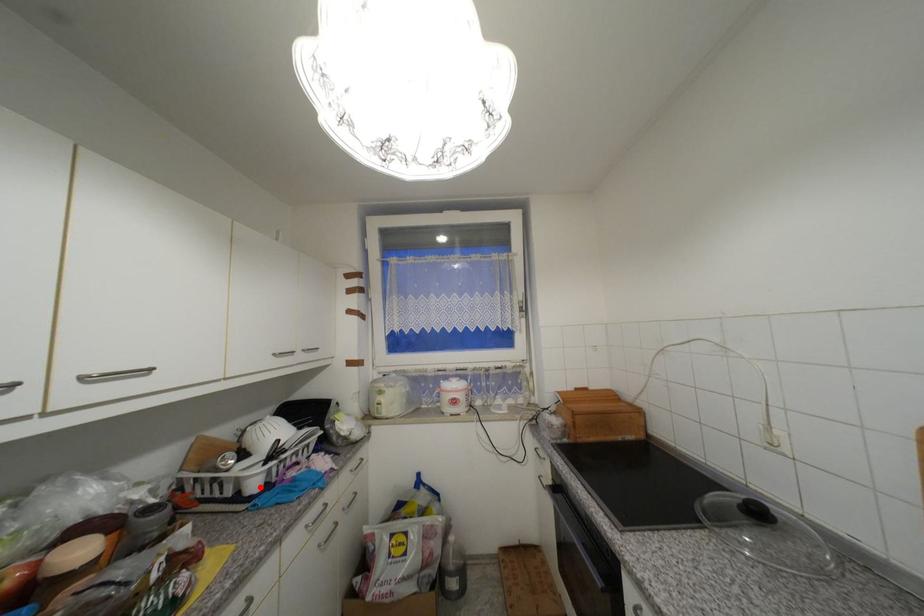
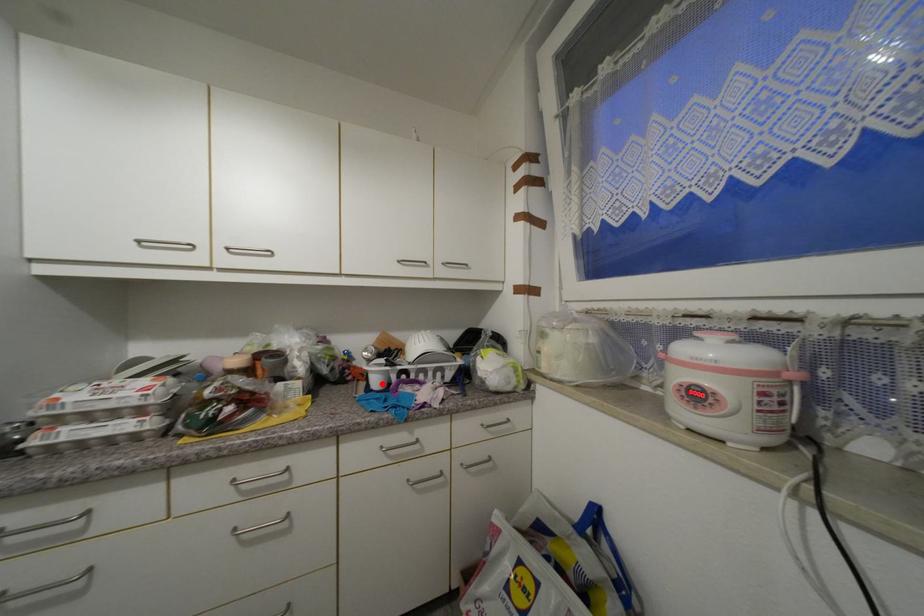
I am providing you with two images of the same scene from different viewpoints. A red point is marked on the first image and another point is marked on the second image. Is the red point in image1 aligned with the point shown in image2?

Yes